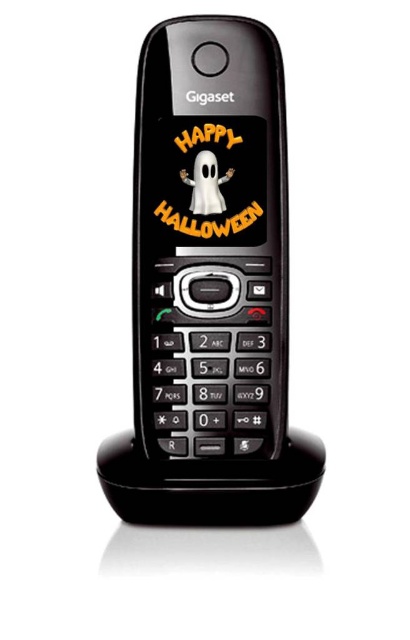
Is point (193, 250) positioned after point (223, 208)?

Yes.

Looking at this image, does black plastic phone at center have a lesser width compared to white matte ghost at center?

No, black plastic phone at center is not thinner than white matte ghost at center.

Locate an element on the screen. black plastic phone at center is located at coordinates (211, 289).